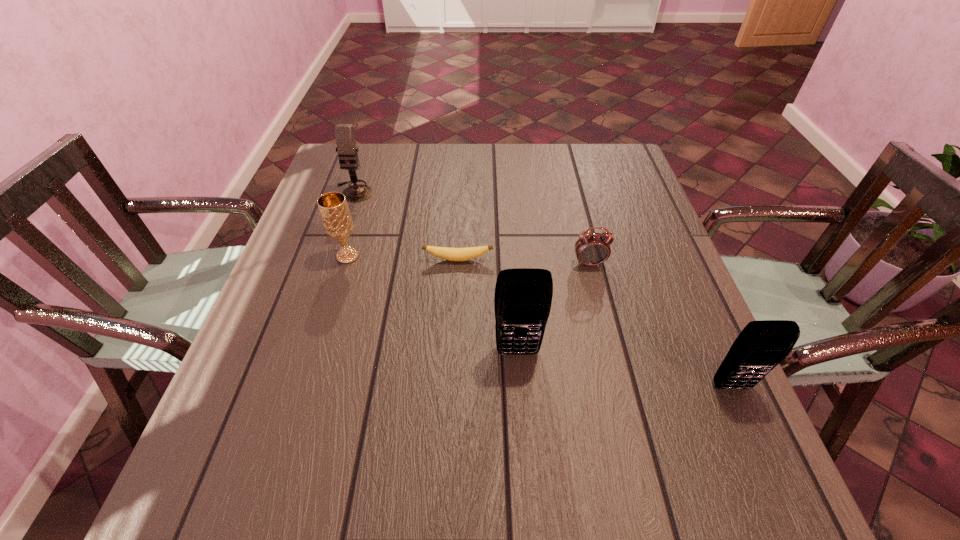
Find the location of a particular element. The width and height of the screenshot is (960, 540). vacant space located on the screen of the nearest object is located at coordinates (752, 433).

The width and height of the screenshot is (960, 540). Identify the location of vacant space located 0.160m on the front-facing side of the farthest object. (338, 241).

Where is `vacant space located on the face of the second shortest object`? vacant space located on the face of the second shortest object is located at coordinates (610, 346).

Locate an element on the screen. The width and height of the screenshot is (960, 540). free space located on the right of the banana is located at coordinates 610,260.

Locate an element on the screen. This screenshot has height=540, width=960. free space located on the back of the chalice is located at coordinates (365, 199).

This screenshot has height=540, width=960. I want to click on object situated at the far edge, so click(344, 133).

Where is `object that is at the near edge`? object that is at the near edge is located at coordinates (762, 345).

Image resolution: width=960 pixels, height=540 pixels. Identify the location of microphone located in the left edge section of the desktop. (344, 133).

At what (x,y) coordinates should I click in order to perform the action: click on chalice that is at the left edge. Please return your answer as a coordinate pair (x, y). This screenshot has width=960, height=540. Looking at the image, I should click on (x=336, y=218).

The height and width of the screenshot is (540, 960). Identify the location of cellular telephone at the right edge. (762, 345).